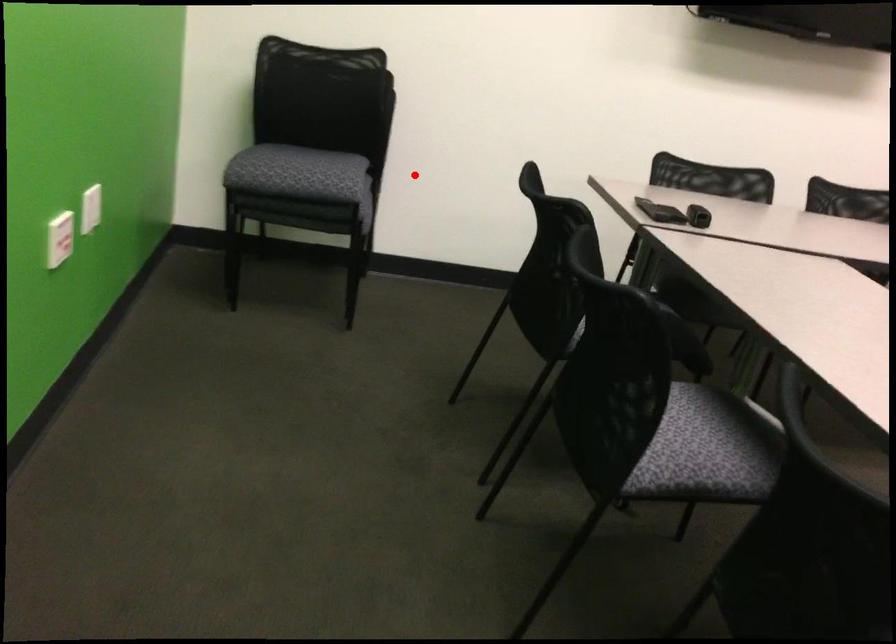
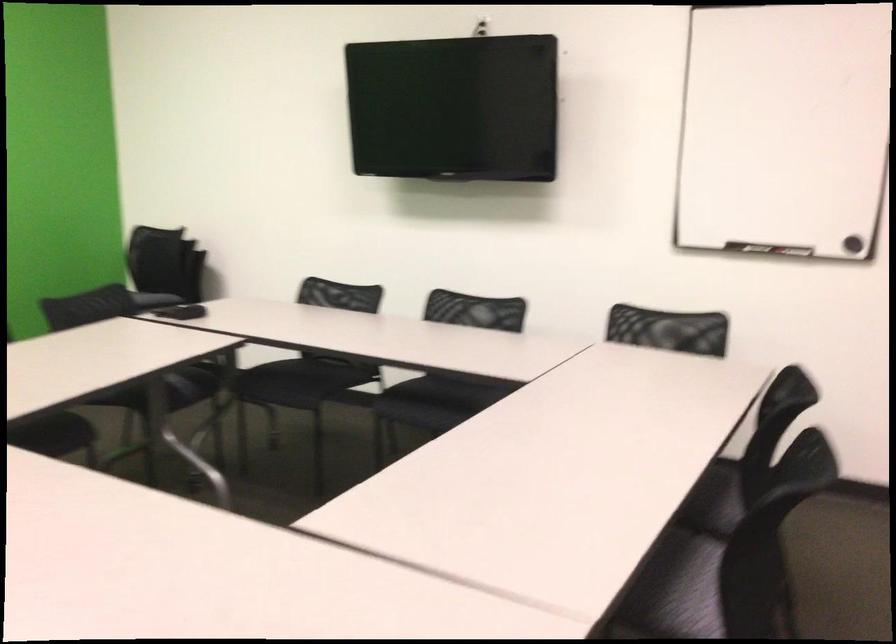
Question: I am providing you with two images of the same scene from different viewpoints. A red point is shown in image1. For the corresponding object point in image2, is it positioned nearer or farther from the camera?

Choices:
 (A) Nearer
 (B) Farther

Answer: (B)